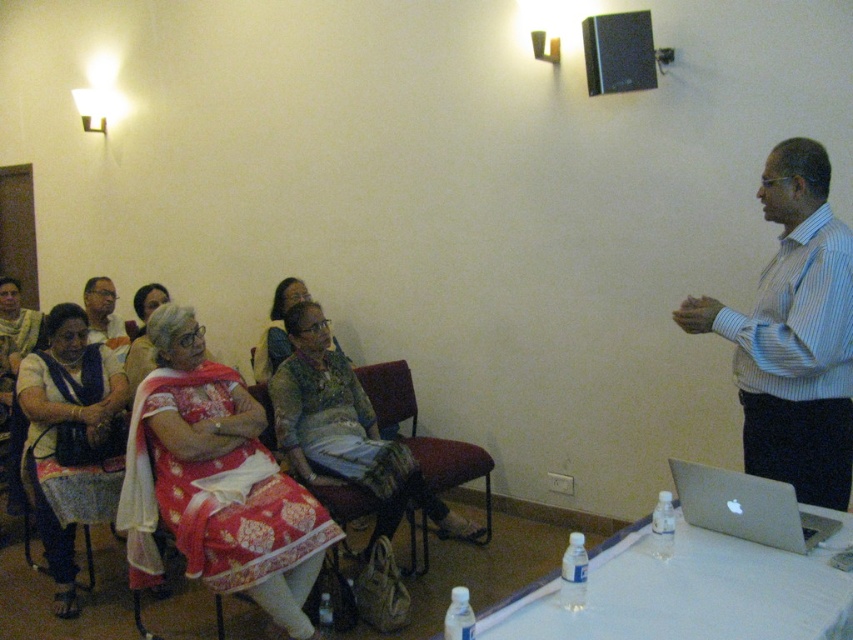
Can you confirm if red silk saree at center left is wider than textured beige dress at center?

No, red silk saree at center left is not wider than textured beige dress at center.

Between point (189, 529) and point (309, 300), which one is positioned in front?

Point (189, 529) is in front.

You are a GUI agent. You are given a task and a screenshot of the screen. Output one action in this format:
    pyautogui.click(x=<x>, y=<y>)
    Task: Click on the red silk saree at center left
    Image resolution: width=853 pixels, height=640 pixels.
    Given the screenshot: What is the action you would take?
    (215, 483)

Locate an element on the screen. This screenshot has height=640, width=853. red silk saree at center left is located at coordinates (215, 483).

Is point (450, 515) farther from camera compared to point (374, 508)?

That is True.

What do you see at coordinates (343, 429) in the screenshot? I see `textured beige dress at center` at bounding box center [343, 429].

In order to click on textured beige dress at center in this screenshot , I will do `click(343, 429)`.

Can you confirm if red silk saree at center left is shorter than matte green dress at center?

No.

Who is lower down, red silk saree at center left or matte green dress at center?

red silk saree at center left

In order to click on red silk saree at center left in this screenshot , I will do `click(215, 483)`.